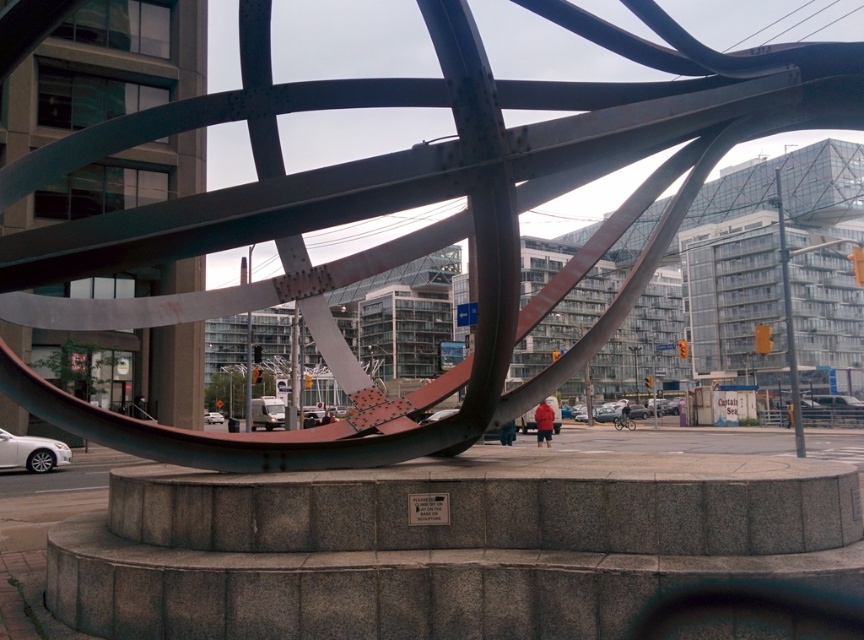
You are a delivery person carrying a package that requires a 5 feet clearance to pass through a narrow alleyway. You see the red matte jacket at center and the denim jacket at center in your path. Can you safely navigate through the space between them without hitting the jackets?

The distance between the red matte jacket at center and the denim jacket at center is 4.92 feet, which is slightly less than the required 5 feet clearance. Therefore, navigating through the space might be risky as there isn

Looking at this image, you are an urban planner assessing the central plaza. You notice the polished steel sculpture at center and the denim jacket at center. Which object takes up more area in the plaza?

The denim jacket at center occupies more space than the polished steel sculpture at center, so the denim jacket takes up more area in the plaza.

You are standing at the entrance of the city park and want to find the polished steel sculpture at center. According to the map, your current position is at point 0.312, 0.512. Is the sculpture located to your north or south?

The polished steel sculpture at center is located at point (x=442, y=198), which matches your current position. Therefore, you are already standing at the sculpture.